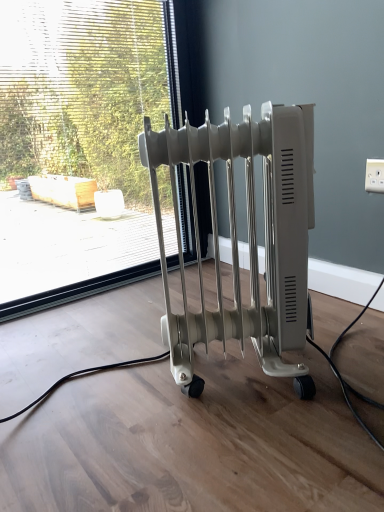
Question: Should I look upward or downward to see white plastic outlet at upper right?

Choices:
 (A) up
 (B) down

Answer: (A)

Question: Does transparent glass window at center have a greater height compared to white plastic outlet at upper right?

Choices:
 (A) yes
 (B) no

Answer: (A)

Question: Is transparent glass window at center not inside white plastic outlet at upper right?

Choices:
 (A) no
 (B) yes

Answer: (B)

Question: Is transparent glass window at center positioned behind white plastic outlet at upper right?

Choices:
 (A) yes
 (B) no

Answer: (A)

Question: Is transparent glass window at center in front of white plastic outlet at upper right?

Choices:
 (A) no
 (B) yes

Answer: (A)

Question: Can you confirm if transparent glass window at center is smaller than white plastic outlet at upper right?

Choices:
 (A) yes
 (B) no

Answer: (B)

Question: Is transparent glass window at center at the left side of white plastic outlet at upper right?

Choices:
 (A) yes
 (B) no

Answer: (A)

Question: Can you confirm if white plastic radiator at center is positioned to the left of transparent glass window at center?

Choices:
 (A) yes
 (B) no

Answer: (B)

Question: Can you confirm if white plastic radiator at center is wider than transparent glass window at center?

Choices:
 (A) yes
 (B) no

Answer: (A)

Question: From the image's perspective, is white plastic radiator at center beneath transparent glass window at center?

Choices:
 (A) yes
 (B) no

Answer: (A)

Question: Could transparent glass window at center be considered to be inside white plastic radiator at center?

Choices:
 (A) no
 (B) yes

Answer: (A)

Question: From the image's perspective, is white plastic radiator at center located above transparent glass window at center?

Choices:
 (A) yes
 (B) no

Answer: (B)

Question: Can you confirm if white plastic radiator at center is taller than transparent glass window at center?

Choices:
 (A) no
 (B) yes

Answer: (A)

Question: From a real-world perspective, does transparent glass window at center sit lower than white plastic radiator at center?

Choices:
 (A) no
 (B) yes

Answer: (A)